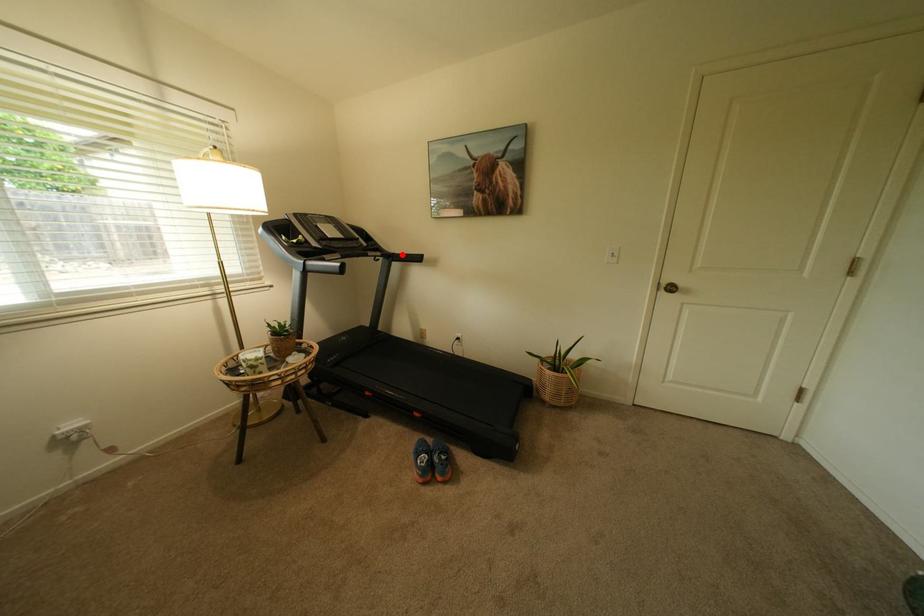
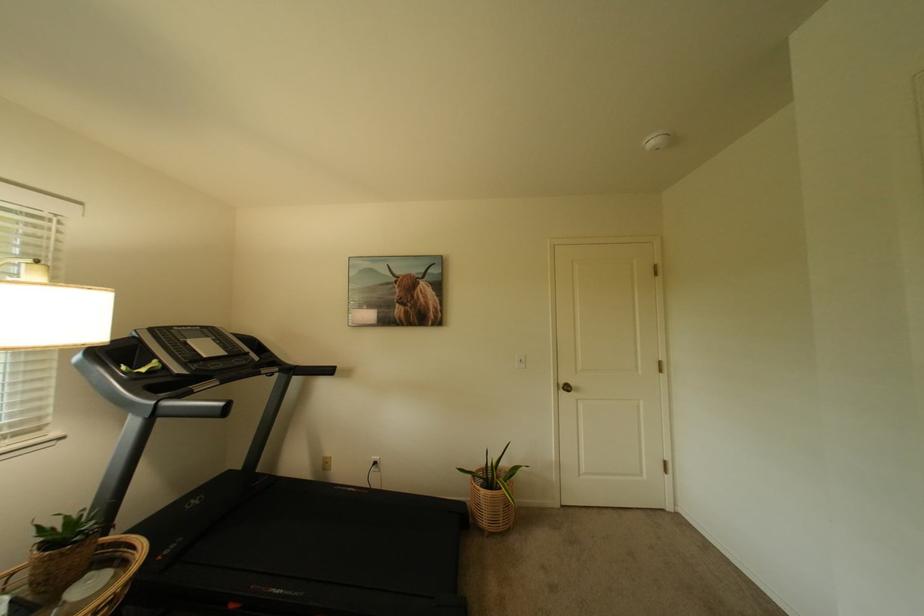
Question: I am providing you with two images of the same scene from different viewpoints. In image1, a red point is highlighted. Considering the same 3D point in image2, which of the following is correct?

Choices:
 (A) It is closer
 (B) It is farther

Answer: (B)